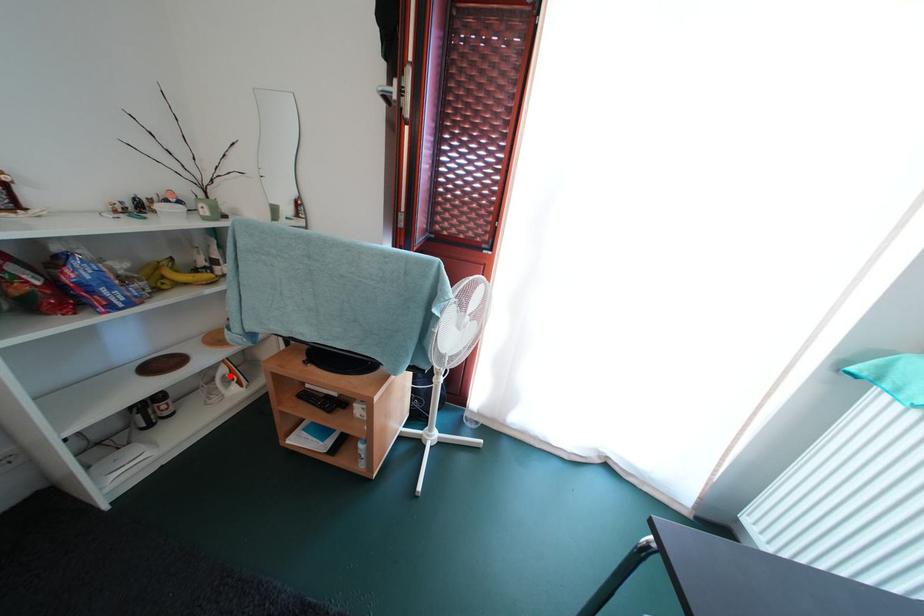
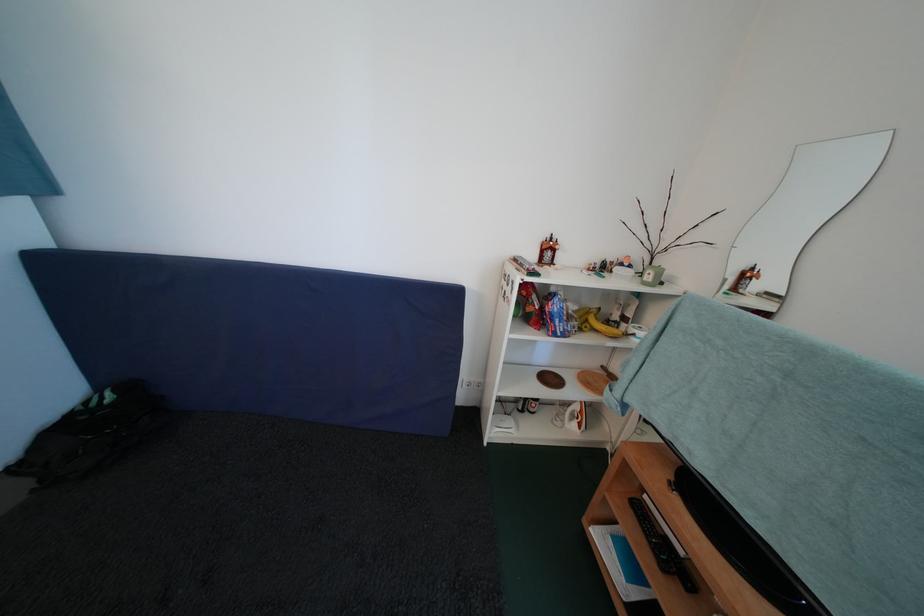
In the second image, find the point that corresponds to the highlighted location in the first image.

(584, 411)